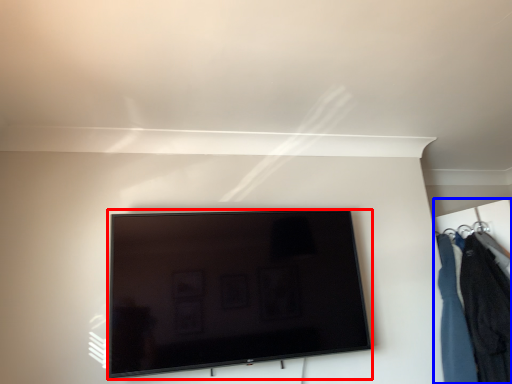
Question: Which object appears farthest to the camera in this image, television (highlighted by a red box) or closet (highlighted by a blue box)?

Choices:
 (A) television
 (B) closet

Answer: (B)